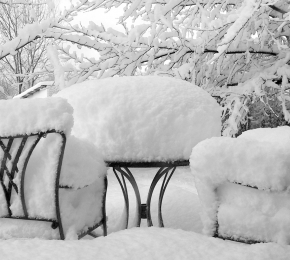
In order to click on backrest in this screenshot , I will do `click(14, 176)`.